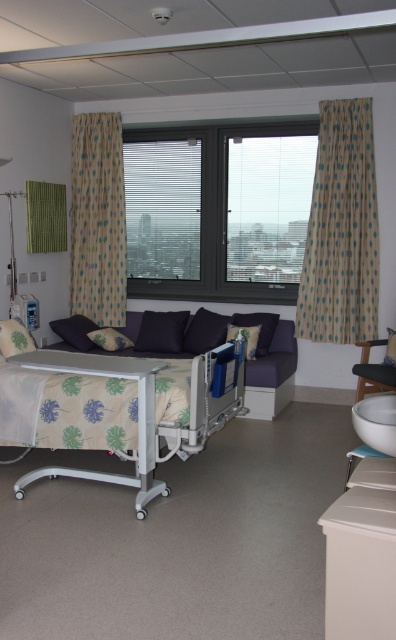
Based on the photo, is velvet purple pillow at center positioned in front of velvet dark purple pillow at center?

That is False.

Is velvet purple pillow at center thinner than velvet dark purple pillow at center?

No, velvet purple pillow at center is not thinner than velvet dark purple pillow at center.

Which is behind, point (270, 333) or point (255, 348)?

Point (270, 333)

Image resolution: width=396 pixels, height=640 pixels. In order to click on velvet purple pillow at center in this screenshot , I will do `click(260, 328)`.

Is polka dot fabric curtain at left to the left of velvet purple pillow at center from the viewer's perspective?

Correct, you'll find polka dot fabric curtain at left to the left of velvet purple pillow at center.

Can you confirm if polka dot fabric curtain at left is positioned below velvet purple pillow at center?

No, polka dot fabric curtain at left is not below velvet purple pillow at center.

Who is more distant from viewer, [125,292] or [239,317]?

The point [125,292] is more distant.

The height and width of the screenshot is (640, 396). Identify the location of polka dot fabric curtain at left. (97, 220).

Describe the element at coordinates (15, 339) in the screenshot. I see `fluffy white pillow at left` at that location.

Is point (17, 336) closer to viewer compared to point (251, 333)?

That is True.

Is point (34, 346) behind point (230, 332)?

No, (34, 346) is closer to viewer.

Locate an element on the screen. The width and height of the screenshot is (396, 640). fluffy white pillow at left is located at coordinates (15, 339).